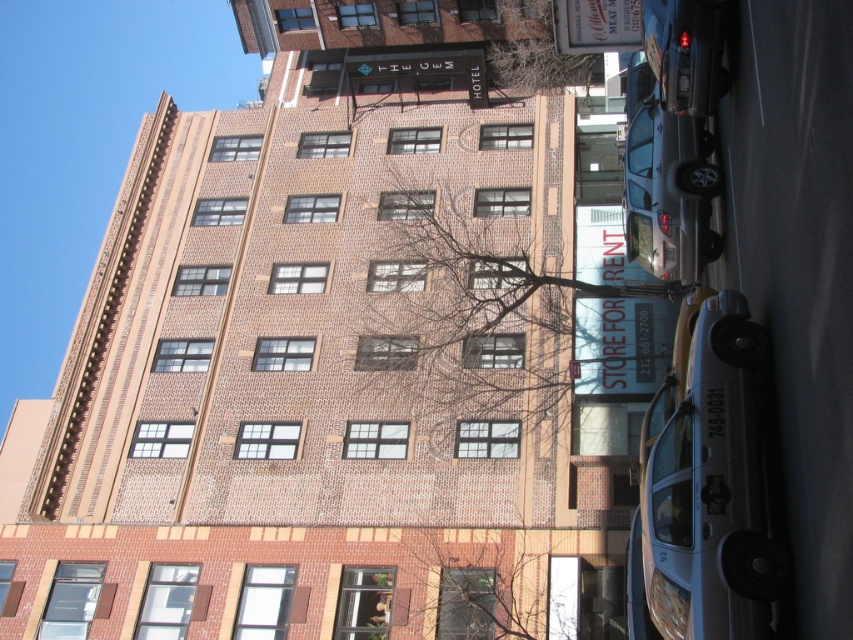
Question: Considering the real-world distances, which object is closest to the shiny black car at upper right?

Choices:
 (A) bare branches at center
 (B) white plastic sign at upper center
 (C) metallic silver taxi at lower right
 (D) bare branches at upper center

Answer: (B)

Question: In this image, where is bare branches at center located relative to bare branches at upper center?

Choices:
 (A) above
 (B) below

Answer: (B)

Question: Which object is the farthest from the bare branches at center?

Choices:
 (A) bare branches at upper center
 (B) metallic silver taxi at lower right
 (C) white plastic sign at upper center

Answer: (A)

Question: Does metallic silver taxi at lower right lie behind shiny black car at upper right?

Choices:
 (A) yes
 (B) no

Answer: (B)

Question: Based on their relative distances, which object is farther from the shiny black car at upper right?

Choices:
 (A) bare branches at upper center
 (B) metallic silver taxi at lower right
 (C) white plastic sign at upper center

Answer: (A)

Question: Is bare branches at upper center further to camera compared to white plastic sign at upper center?

Choices:
 (A) yes
 (B) no

Answer: (A)